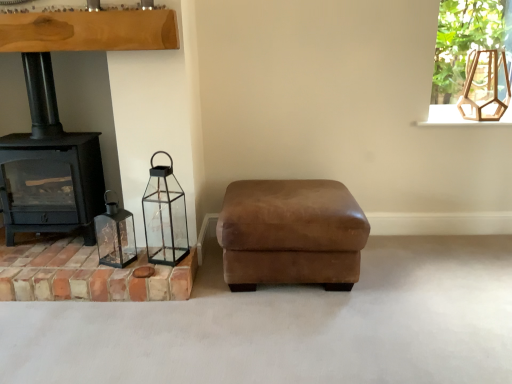
In order to click on vacant space that is to the left of matte glass lantern at left, arranged as the second candle holder when viewed from the right in this screenshot , I will do `click(81, 255)`.